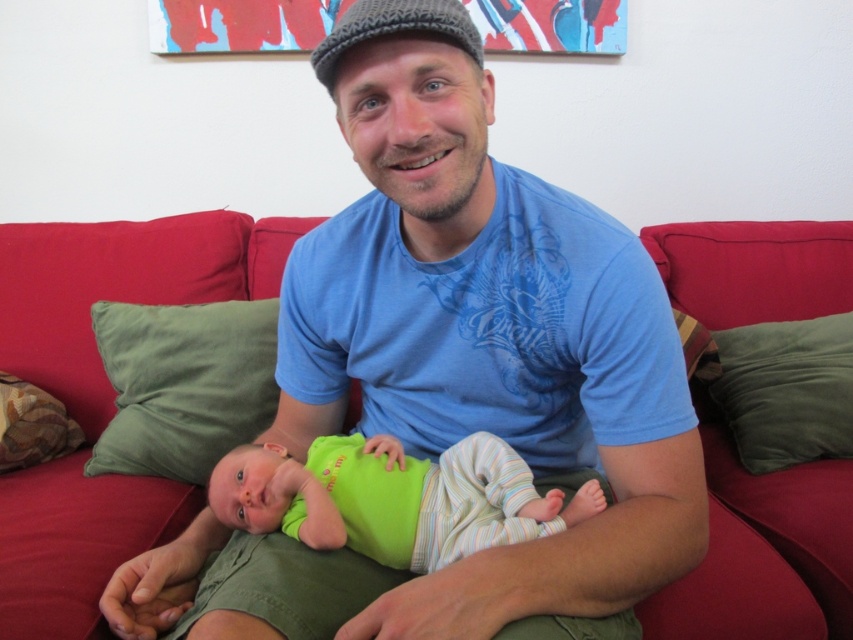
Question: Is green soft fabric baby at center to the left of green soft pillow at right from the viewer's perspective?

Choices:
 (A) yes
 (B) no

Answer: (A)

Question: Does green soft fabric baby at center appear under green fabric pillow at left?

Choices:
 (A) no
 (B) yes

Answer: (B)

Question: Based on their relative distances, which object is farther from the green soft fabric baby at center?

Choices:
 (A) green fabric pillow at left
 (B) green soft pillow at right
 (C) blue cotton shirt at center
 (D) patterned fabric pillow at left

Answer: (B)

Question: Is the position of blue cotton shirt at center more distant than that of patterned fabric pillow at left?

Choices:
 (A) yes
 (B) no

Answer: (B)

Question: Among these points, which one is nearest to the camera?

Choices:
 (A) (351, 493)
 (B) (15, 448)
 (C) (157, 346)
 (D) (631, 536)

Answer: (D)

Question: Among these points, which one is farthest from the camera?

Choices:
 (A) (96, 458)
 (B) (376, 472)
 (C) (822, 387)

Answer: (C)